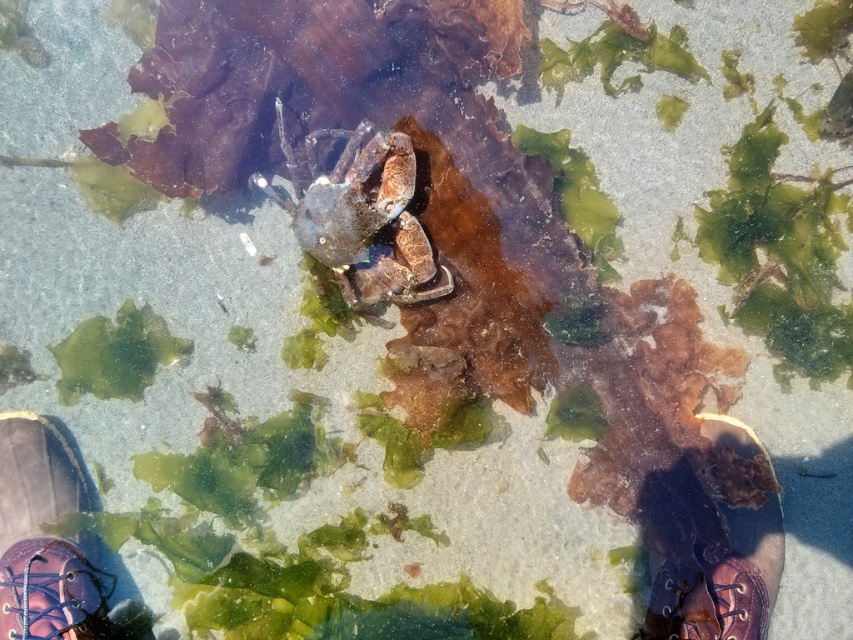
Which of these two, shiny purple shoe at lower left or shiny purple shoe at lower right, stands taller?

With more height is shiny purple shoe at lower right.

Which is below, shiny purple shoe at lower left or shiny purple shoe at lower right?

shiny purple shoe at lower right is below.

Is point (61, 579) closer to viewer compared to point (764, 513)?

No, it is not.

Locate an element on the screen. shiny purple shoe at lower left is located at coordinates (42, 536).